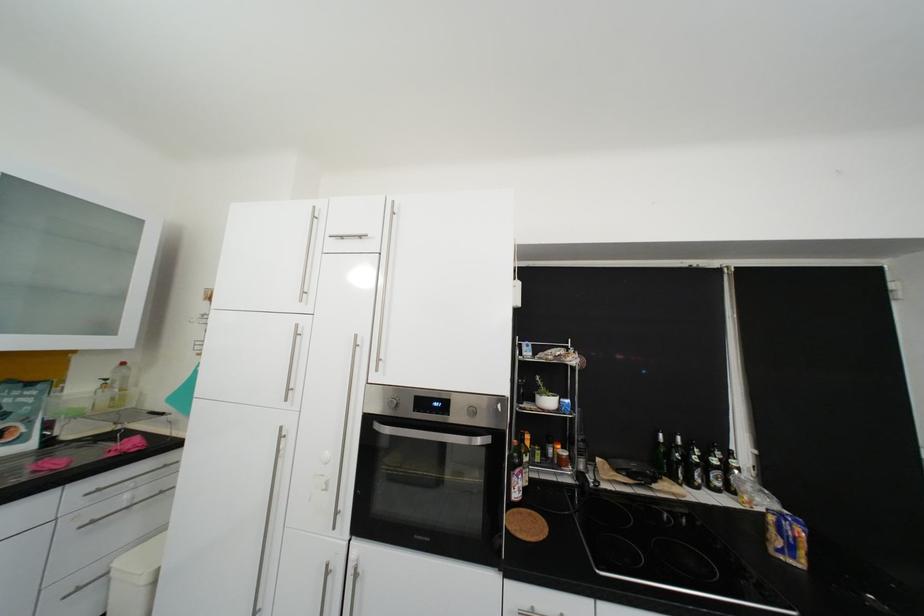
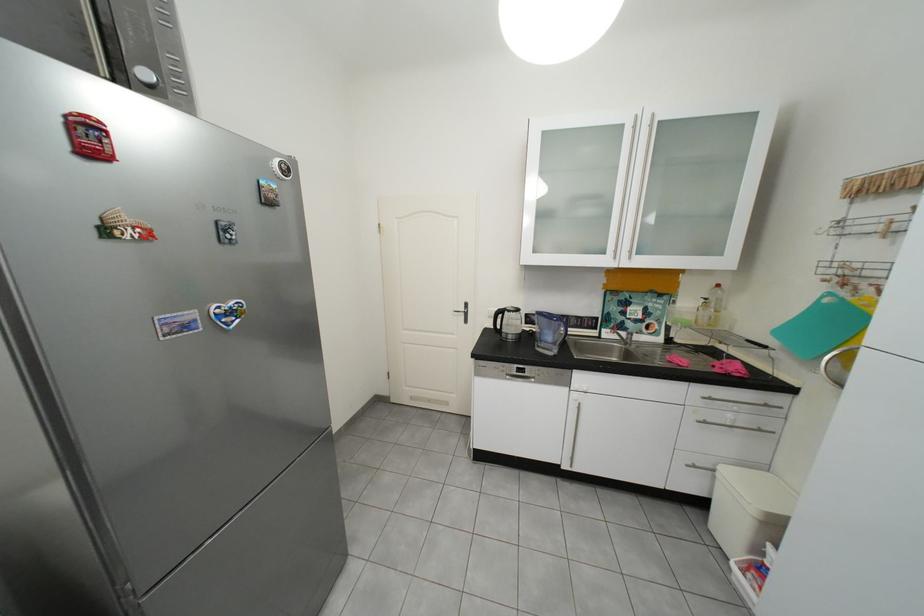
The point at (104, 523) is marked in the first image. Where is the corresponding point in the second image?

(718, 424)